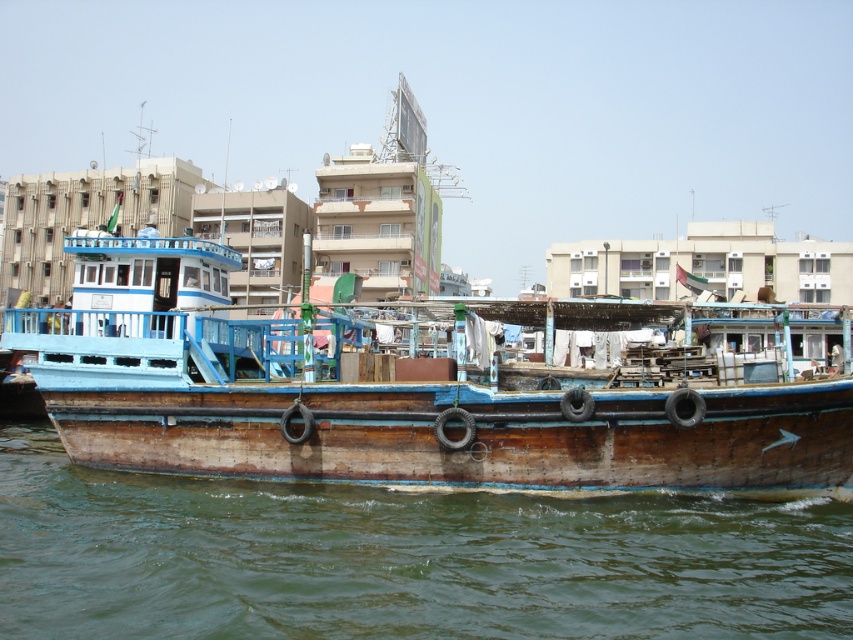
Question: Among these points, which one is nearest to the camera?

Choices:
 (A) (440, 314)
 (B) (730, 508)

Answer: (B)

Question: Is wooden boat at center wider than brown wooden water at lower center?

Choices:
 (A) yes
 (B) no

Answer: (A)

Question: Which object is closer to the camera taking this photo?

Choices:
 (A) brown wooden water at lower center
 (B) wooden boat at center

Answer: (A)

Question: Which of the following is the closest to the observer?

Choices:
 (A) (422, 586)
 (B) (827, 460)

Answer: (A)

Question: From the image, what is the correct spatial relationship of wooden boat at center in relation to brown wooden water at lower center?

Choices:
 (A) below
 (B) above

Answer: (B)

Question: Can you confirm if wooden boat at center is positioned to the left of brown wooden water at lower center?

Choices:
 (A) yes
 (B) no

Answer: (B)